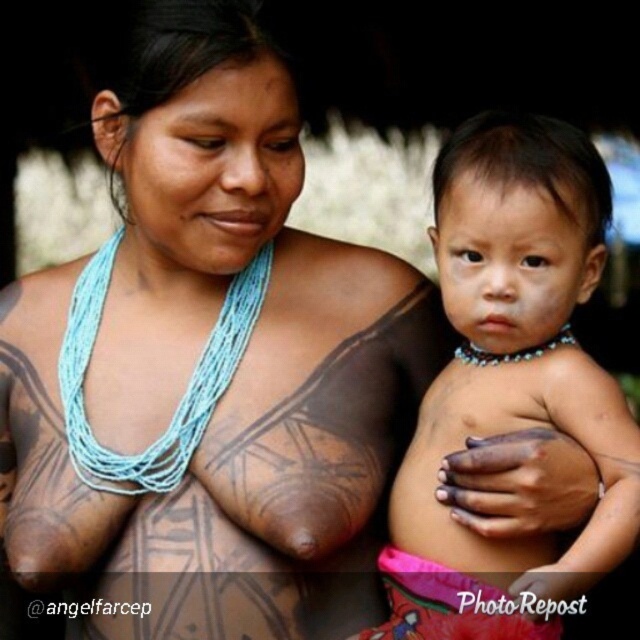
You are a photographer adjusting the lighting for a portrait. You need to ensure that the matte skin baby at center and the blue string necklace at upper center are both well lit. Based on their positions, which object should you adjust the light towards first to ensure proper exposure?

The blue string necklace at upper center should be adjusted first because the matte skin baby at center is to the right of it, so moving the light towards the necklace will also help illuminate the baby.

Based on the photo, you are standing 5 feet away from the image. You want to reach the point at coordinates point (570, 371). Can you reach it without moving closer?

The distance of point (570, 371) from viewer is 3.93 feet, so yes, you can reach it without moving closer since you are already 5 feet away, which is farther than the point.

You are a photographer adjusting the lighting for a portrait. You need to ensure that both the matte skin baby at center and the blue beaded necklace at upper center are well lit. Given their sizes, which object requires a wider light source to properly illuminate?

The matte skin baby at center requires a wider light source because its width is larger than the blue beaded necklace at upper center.